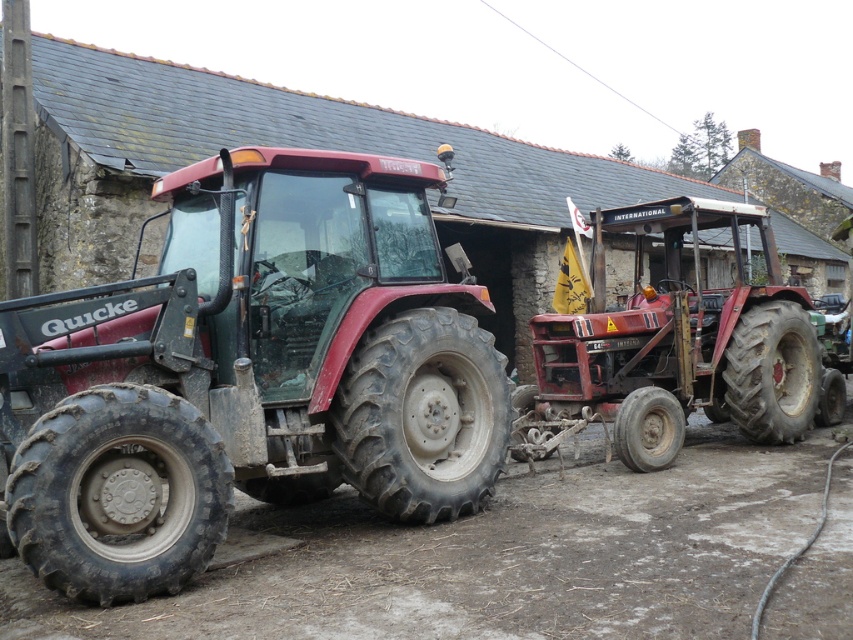
Question: Estimate the real-world distances between objects in this image. Which object is farther from the dark gray rubber tire at center right?

Choices:
 (A) rubber/rough tire at right
 (B) matte red tractor at left
 (C) rusty metal tractor at right

Answer: (B)

Question: Does rubber/rough tire at right have a greater width compared to dirty rubber tire at right?

Choices:
 (A) yes
 (B) no

Answer: (A)

Question: Which object appears farthest from the camera in this image?

Choices:
 (A) rusty metal tractor at right
 (B) rubber/rough tire at right

Answer: (B)

Question: Which point is farther to the camera?

Choices:
 (A) (843, 412)
 (B) (816, 387)

Answer: (A)

Question: Is matte red tractor at left further to the viewer compared to rubber/rough tire at right?

Choices:
 (A) yes
 (B) no

Answer: (B)

Question: Does black rubber tire at lower left appear on the right side of black rubber tire at center?

Choices:
 (A) no
 (B) yes

Answer: (A)